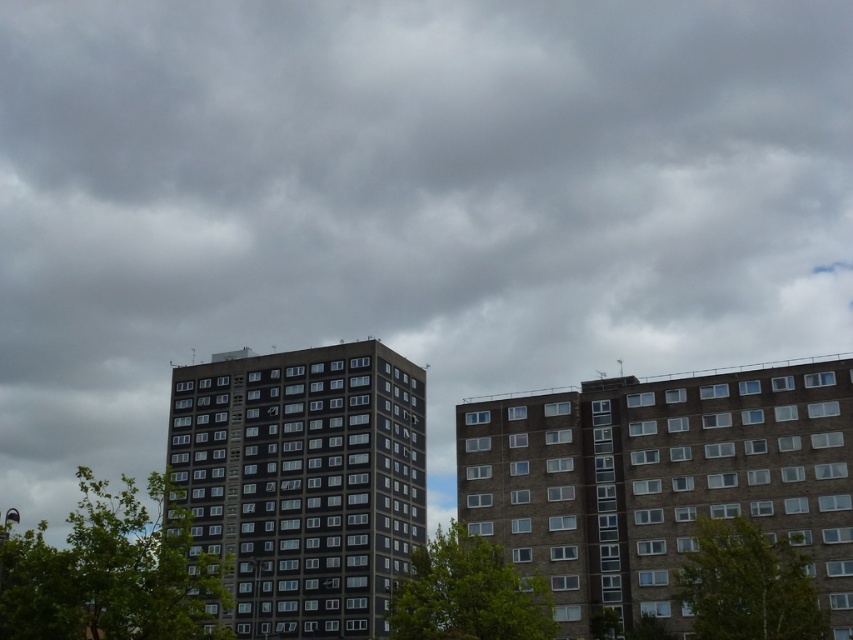
Question: Which object is the farthest from the green leafy tree at lower left?

Choices:
 (A) green leafy tree at lower center
 (B) dark gray concrete building at center

Answer: (A)

Question: Which point is farther to the camera?

Choices:
 (A) green leafy tree at lower center
 (B) dark gray concrete building at center
 (C) green leafy tree at center

Answer: (C)

Question: Does dark gray concrete building at center have a lesser width compared to green leafy tree at center?

Choices:
 (A) no
 (B) yes

Answer: (A)

Question: Does dark gray concrete building at center lie behind green leafy tree at lower left?

Choices:
 (A) yes
 (B) no

Answer: (A)

Question: Which point appears farthest from the camera in this image?

Choices:
 (A) (398, 472)
 (B) (477, 548)
 (C) (154, 541)

Answer: (A)

Question: Is dark gray concrete building at center below green leafy tree at lower center?

Choices:
 (A) no
 (B) yes

Answer: (A)